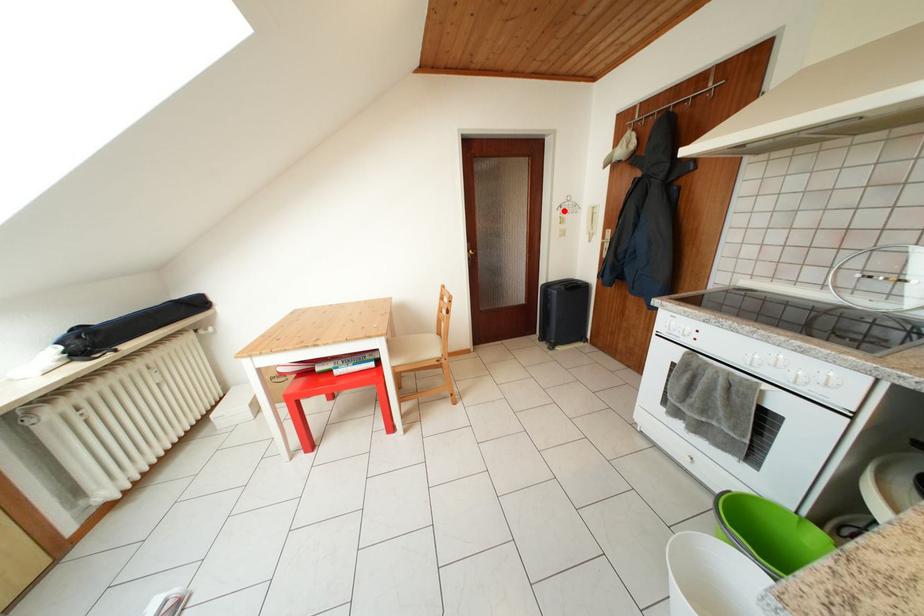
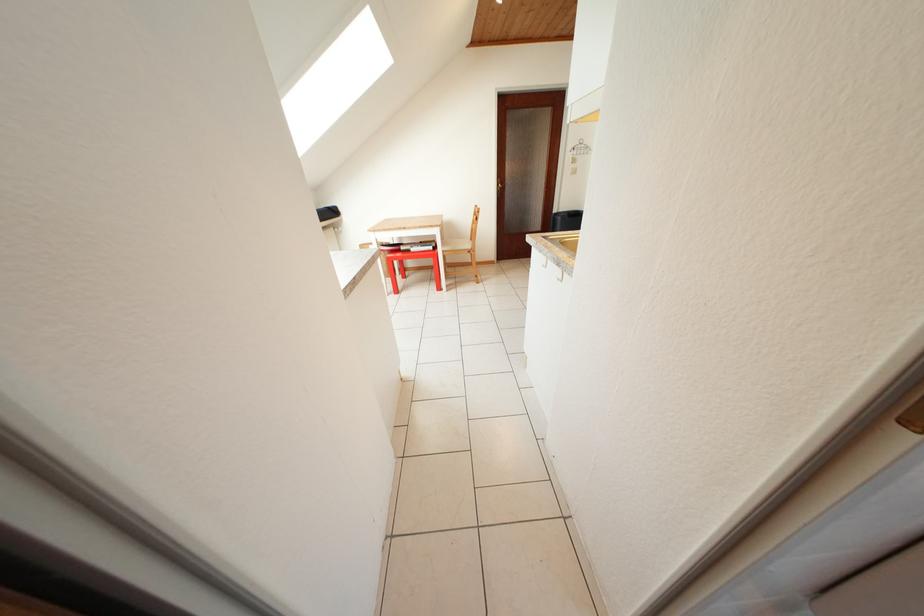
The point at the highlighted location is marked in the first image. Where is the corresponding point in the second image?

(578, 153)